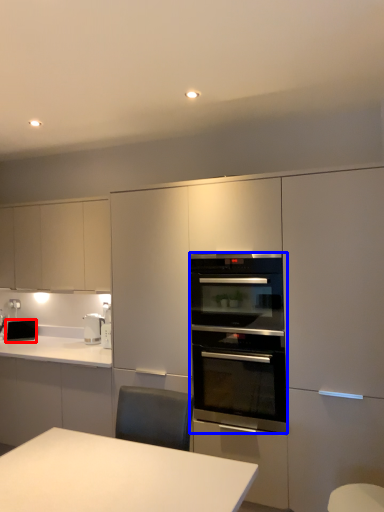
Question: Which object appears farthest to the camera in this image, appliance (highlighted by a red box) or kitchen appliance (highlighted by a blue box)?

Choices:
 (A) appliance
 (B) kitchen appliance

Answer: (A)